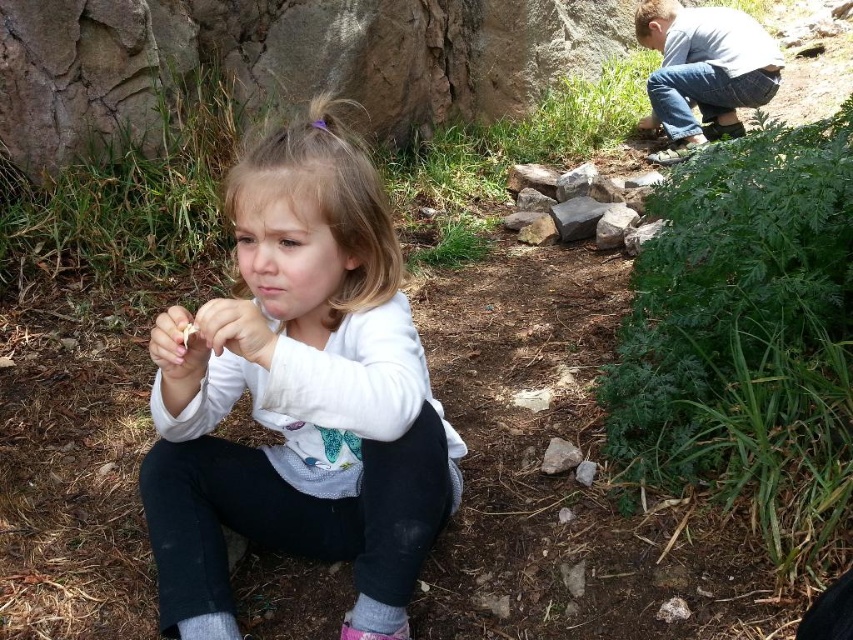
Question: Which is farther from the white matte shirt at center?

Choices:
 (A) gray rock at center
 (B) gray cotton sock at lower center
 (C) light gray cotton shirt at upper right

Answer: (C)

Question: Which point is closer to the camera taking this photo?

Choices:
 (A) (212, 627)
 (B) (312, 243)
 (C) (341, 630)

Answer: (B)

Question: Is light gray cotton shirt at upper right smaller than gray rock at center?

Choices:
 (A) no
 (B) yes

Answer: (B)

Question: Does gray rock at center have a greater width compared to gray woolen sock at lower left?

Choices:
 (A) no
 (B) yes

Answer: (B)

Question: Can you confirm if gray rock at center is bigger than gray cotton sock at lower center?

Choices:
 (A) yes
 (B) no

Answer: (A)

Question: Which point is farther to the camera?

Choices:
 (A) gray rock at center
 (B) gray rough rock at center
 (C) gray woolen sock at lower left

Answer: (A)